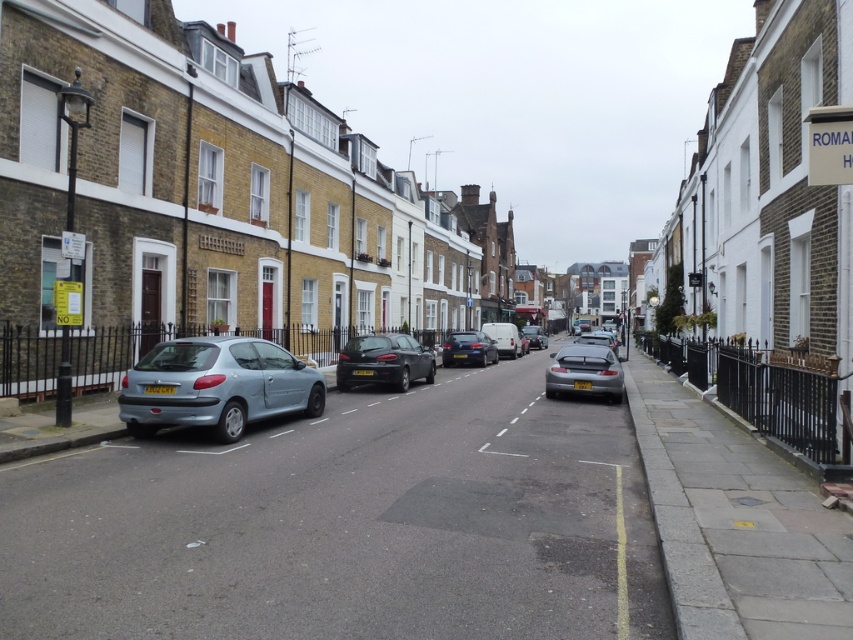
Is satin silver hatchback at left shorter than matte silver car at center?

Correct, satin silver hatchback at left is not as tall as matte silver car at center.

Can you confirm if satin silver hatchback at left is wider than matte silver car at center?

No, satin silver hatchback at left is not wider than matte silver car at center.

What do you see at coordinates (216, 385) in the screenshot?
I see `satin silver hatchback at left` at bounding box center [216, 385].

Image resolution: width=853 pixels, height=640 pixels. Find the location of `satin silver hatchback at left`. satin silver hatchback at left is located at coordinates (216, 385).

Is point (352, 349) farther from viewer compared to point (540, 330)?

No, it is not.

Between shiny black car at center and matte silver car at center, which one appears on the left side from the viewer's perspective?

shiny black car at center is more to the left.

Find the location of a particular element. This screenshot has width=853, height=640. shiny black car at center is located at coordinates (383, 362).

You are a GUI agent. You are given a task and a screenshot of the screen. Output one action in this format:
    pyautogui.click(x=<x>, y=<y>)
    Task: Click on the shiny black car at center
    The width and height of the screenshot is (853, 640).
    Given the screenshot: What is the action you would take?
    pyautogui.click(x=383, y=362)

Which is behind, point (469, 333) or point (538, 332)?

Point (538, 332)

Who is more distant from viewer, [459,346] or [538,348]?

Point [538,348]

The width and height of the screenshot is (853, 640). I want to click on glossy metallic car at center, so click(468, 348).